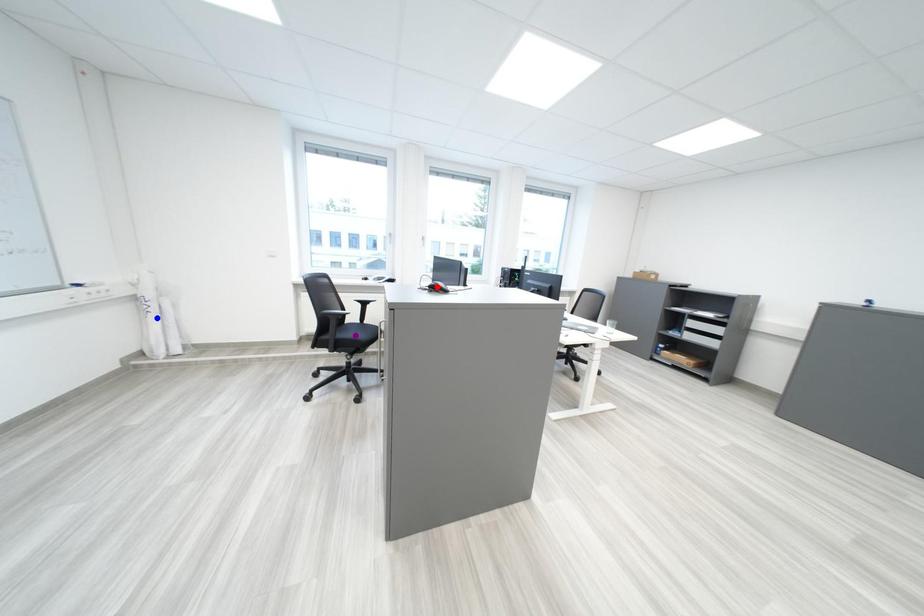
Order these from nearest to farthest:
red point, purple point, blue point

1. blue point
2. purple point
3. red point